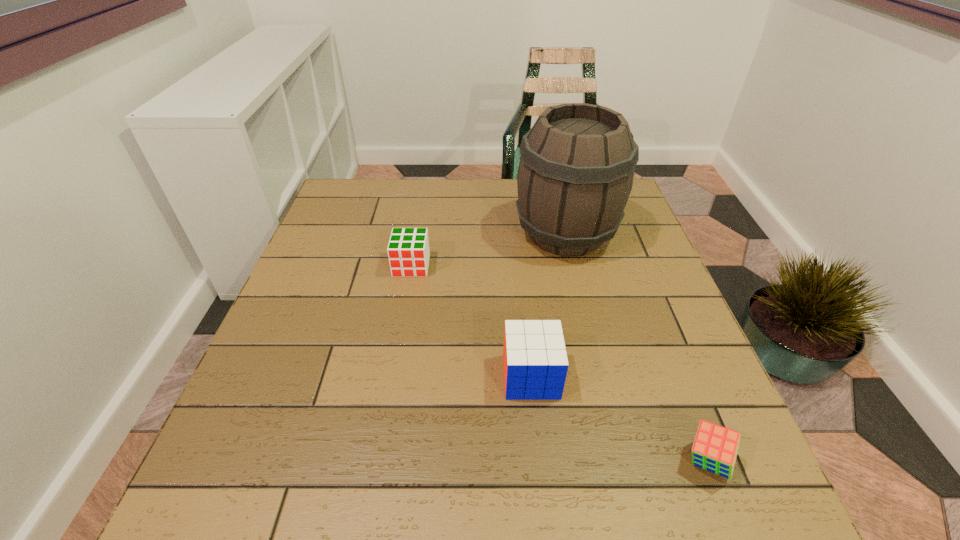
At what (x,y) coordinates should I click in order to perform the action: click on vacant region that satisfies the following two spatial constraints: 1. on the red face of the farthest cube; 2. on the left side of the second nearest object. Please return your answer as a coordinate pair (x, y). This screenshot has height=540, width=960. Looking at the image, I should click on (392, 376).

Where is `free spot that satisfies the following two spatial constraints: 1. on the red face of the leftmost cube; 2. on the left side of the second cube from right to left`? The image size is (960, 540). free spot that satisfies the following two spatial constraints: 1. on the red face of the leftmost cube; 2. on the left side of the second cube from right to left is located at coordinates (392, 376).